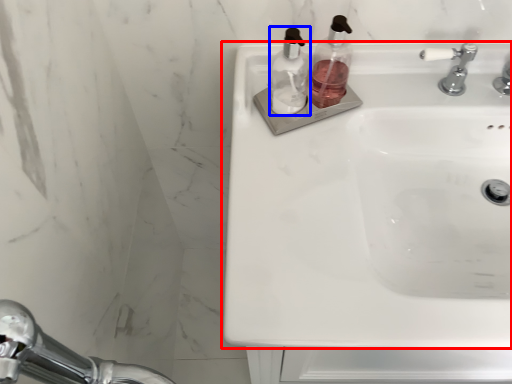
Question: Which of the following is the closest to the observer, sink (highlighted by a red box) or soap dispenser (highlighted by a blue box)?

Choices:
 (A) sink
 (B) soap dispenser

Answer: (A)